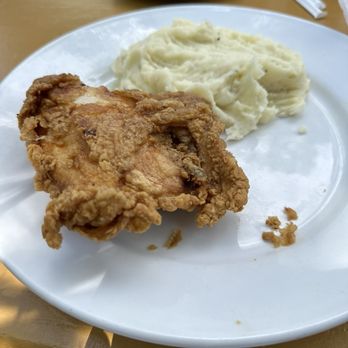
Identify the location of rim of plate. The height and width of the screenshot is (348, 348). (80, 314).